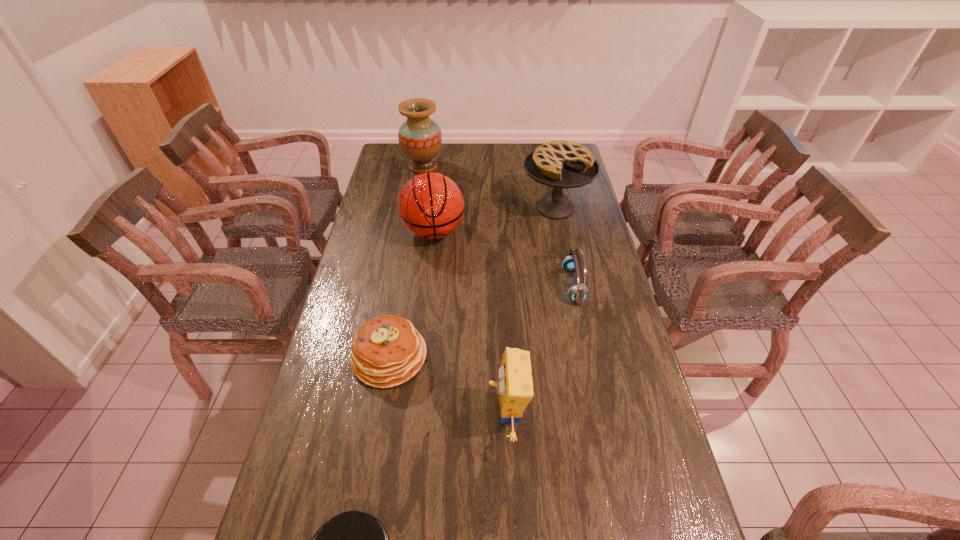
The height and width of the screenshot is (540, 960). Identify the location of vacant space in between the taller pancake and the basketball. (412, 294).

The width and height of the screenshot is (960, 540). Identify the location of free point between the pie and the sixth tallest object. (472, 282).

Find the location of a particular element. free area in between the headset and the basketball is located at coordinates (504, 259).

The height and width of the screenshot is (540, 960). In order to click on vacant area between the basketball and the sponge in this screenshot , I will do `click(470, 323)`.

Find the location of a particular element. The image size is (960, 540). the fourth closest object to the vase is located at coordinates (387, 351).

The image size is (960, 540). Find the location of `the fifth closest object to the nearest object`. the fifth closest object to the nearest object is located at coordinates (562, 164).

Identify the location of vacant position in the image that satisfies the following two spatial constraints: 1. on the cut side of the pie; 2. on the face of the fifth object from left to right. (596, 414).